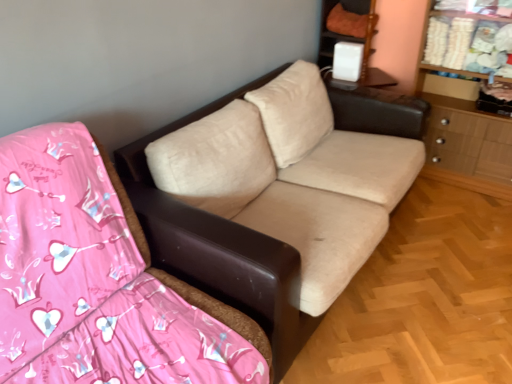
Identify the location of white plastic speaker at upper right. (352, 40).

This screenshot has width=512, height=384. What are the coordinates of `white plastic speaker at upper right` in the screenshot? It's located at (352, 40).

In terms of width, does white plastic speaker at upper right look wider or thinner when compared to wooden dresser at right?

In the image, white plastic speaker at upper right appears to be wider than wooden dresser at right.

Which is nearer, (337, 32) or (511, 121)?

Point (337, 32) appears to be farther away from the viewer than point (511, 121).

Does white plastic speaker at upper right have a larger size compared to wooden dresser at right?

Actually, white plastic speaker at upper right might be smaller than wooden dresser at right.

Is white plastic speaker at upper right positioned before wooden dresser at right?

That is False.

From the image's perspective, would you say white plastic speaker at upper right is shown under beige fabric couch at center?

No.

Which of these two, white plastic speaker at upper right or beige fabric couch at center, is wider?

With larger width is beige fabric couch at center.

Where is `entertainment center lying behind the beige fabric couch at center`? The width and height of the screenshot is (512, 384). entertainment center lying behind the beige fabric couch at center is located at coordinates (352, 40).

Is white plastic speaker at upper right positioned behind beige fabric couch at center?

Yes, the depth of white plastic speaker at upper right is greater than that of beige fabric couch at center.

Is wooden dresser at right at the right side of beige fabric couch at center?

Correct, you'll find wooden dresser at right to the right of beige fabric couch at center.

Is wooden dresser at right in contact with beige fabric couch at center?

There is a gap between wooden dresser at right and beige fabric couch at center.

Considering the relative sizes of wooden dresser at right and beige fabric couch at center in the image provided, is wooden dresser at right shorter than beige fabric couch at center?

Incorrect, the height of wooden dresser at right does not fall short of that of beige fabric couch at center.

Between beige fabric couch at center and white plastic speaker at upper right, which one has smaller size?

beige fabric couch at center is smaller.

Considering the sizes of objects beige fabric couch at center and white plastic speaker at upper right in the image provided, who is shorter, beige fabric couch at center or white plastic speaker at upper right?

Standing shorter between the two is beige fabric couch at center.

Is beige fabric couch at center directly adjacent to white plastic speaker at upper right?

No, beige fabric couch at center is not with white plastic speaker at upper right.

From a real-world perspective, is beige fabric couch at center over white plastic speaker at upper right?

No, from a real-world perspective, beige fabric couch at center is not over white plastic speaker at upper right

How many degrees apart are the facing directions of wooden dresser at right and white plastic speaker at upper right?

There is a 0.986-degree angle between the facing directions of wooden dresser at right and white plastic speaker at upper right.

From their relative heights in the image, would you say wooden dresser at right is taller or shorter than white plastic speaker at upper right?

Clearly, wooden dresser at right is taller compared to white plastic speaker at upper right.

Is wooden dresser at right oriented towards white plastic speaker at upper right?

No.

Is point (489, 124) positioned behind point (362, 53)?

No, (489, 124) is in front of (362, 53).

Is beige fabric couch at center far from wooden dresser at right?

beige fabric couch at center is positioned a significant distance from wooden dresser at right.

Which is correct: beige fabric couch at center is inside wooden dresser at right, or outside of it?

beige fabric couch at center is located beyond the bounds of wooden dresser at right.

Where is `dresser above the beige fabric couch at center (from a real-world perspective)`? Image resolution: width=512 pixels, height=384 pixels. dresser above the beige fabric couch at center (from a real-world perspective) is located at coordinates (465, 134).

How many degrees apart are the facing directions of beige fabric couch at center and wooden dresser at right?

The facing directions of beige fabric couch at center and wooden dresser at right are 90.3 degrees apart.

In order to click on dresser below the white plastic speaker at upper right (from the image's perspective) in this screenshot , I will do `click(465, 134)`.

Image resolution: width=512 pixels, height=384 pixels. Find the location of `studio couch that appears below the white plastic speaker at upper right (from a real-world perspective)`. studio couch that appears below the white plastic speaker at upper right (from a real-world perspective) is located at coordinates (220, 247).

Estimate the real-world distances between objects in this image. Which object is further from white plastic speaker at upper right, wooden dresser at right or beige fabric couch at center?

Based on the image, beige fabric couch at center appears to be further to white plastic speaker at upper right.

From the image, which object appears to be nearer to wooden dresser at right, white plastic speaker at upper right or beige fabric couch at center?

white plastic speaker at upper right is positioned closer to the anchor wooden dresser at right.

Estimate the real-world distances between objects in this image. Which object is further from white plastic speaker at upper right, beige fabric couch at center or wooden dresser at right?

beige fabric couch at center is further to white plastic speaker at upper right.

Based on their spatial positions, is wooden dresser at right or white plastic speaker at upper right further from beige fabric couch at center?

white plastic speaker at upper right is further to beige fabric couch at center.

Looking at the image, which one is located closer to beige fabric couch at center, white plastic speaker at upper right or wooden dresser at right?

The object closer to beige fabric couch at center is wooden dresser at right.

Based on their spatial positions, is beige fabric couch at center or white plastic speaker at upper right closer to wooden dresser at right?

white plastic speaker at upper right is positioned closer to the anchor wooden dresser at right.

Find the location of a particular element. dresser between white plastic speaker at upper right and beige fabric couch at center vertically is located at coordinates pos(465,134).